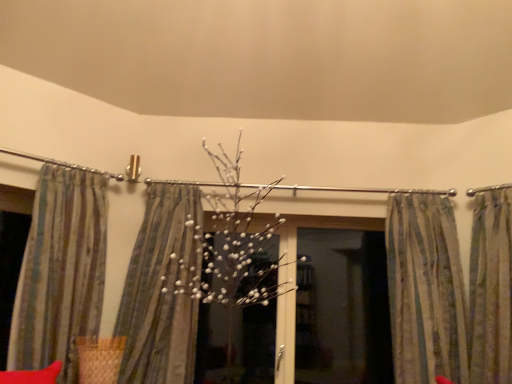
Question: Considering the positions of point (120, 173) and point (483, 296), is point (120, 173) closer or farther from the camera than point (483, 296)?

Choices:
 (A) farther
 (B) closer

Answer: (A)

Question: From their relative heights in the image, would you say metallic silver clothesline at upper left is taller or shorter than striped fabric curtain at right, the first curtain positioned from the right?

Choices:
 (A) short
 (B) tall

Answer: (A)

Question: Which is farther from the striped fabric curtain at right, the third curtain viewed from the left?

Choices:
 (A) transparent glass screen door at center
 (B) striped fabric at center, the second curtain from the left
 (C) striped fabric curtain at right, the 4th curtain positioned from the left
 (D) metallic silver clothesline at upper left
 (E) striped fabric curtain at left, acting as the 1th curtain starting from the left

Answer: (D)

Question: Based on their relative distances, which object is nearer to the metallic silver clothesline at upper left?

Choices:
 (A) transparent glass screen door at center
 (B) striped fabric curtain at left, acting as the 1th curtain starting from the left
 (C) striped fabric curtain at right, the third curtain viewed from the left
 (D) striped fabric curtain at right, the 4th curtain positioned from the left
 (E) striped fabric at center, the third curtain positioned from the right

Answer: (B)